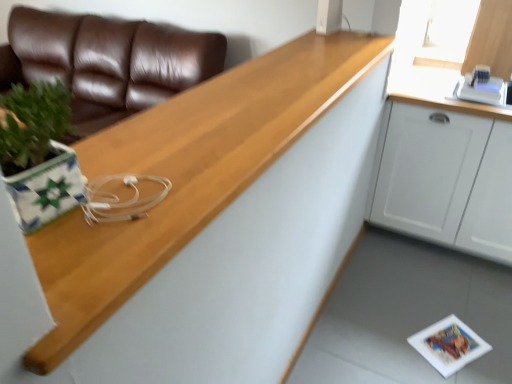
Question: Considering their positions, is wooden at left located in front of or behind white matte cabinet at upper right?

Choices:
 (A) front
 (B) behind

Answer: (A)

Question: From the image's perspective, is wooden at left located above or below white matte cabinet at upper right?

Choices:
 (A) below
 (B) above

Answer: (B)

Question: Estimate the real-world distances between objects in this image. Which object is closer to the brown leather couch at upper left?

Choices:
 (A) white matte cabinet at upper right
 (B) wooden at left

Answer: (B)

Question: Estimate the real-world distances between objects in this image. Which object is farther from the brown leather couch at upper left?

Choices:
 (A) white matte cabinet at upper right
 (B) wooden at left

Answer: (A)